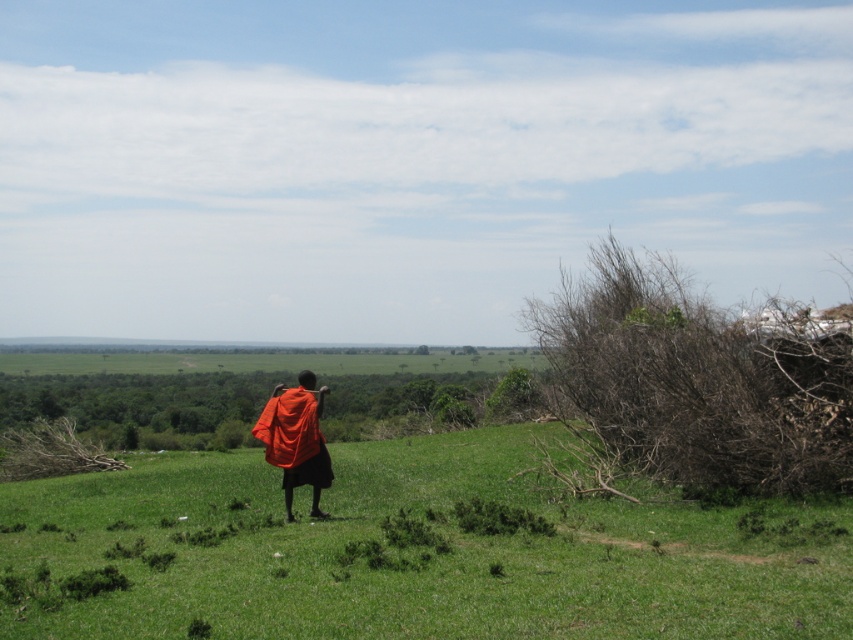
The image size is (853, 640). Describe the element at coordinates (410, 554) in the screenshot. I see `green grassy at center` at that location.

Which is in front, point (451, 506) or point (283, 454)?

Point (283, 454)

Does point (242, 593) lie behind point (291, 497)?

No, it is in front of (291, 497).

Locate an element on the screen. The height and width of the screenshot is (640, 853). green grassy at center is located at coordinates (410, 554).